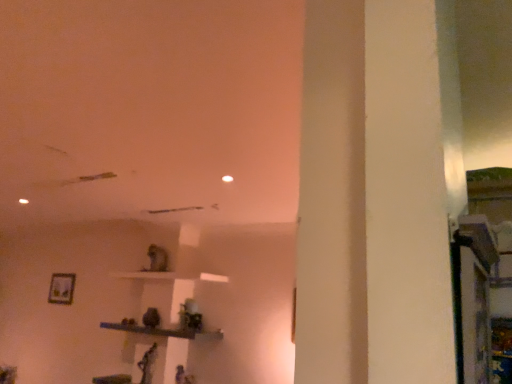
What do you see at coordinates (61, 288) in the screenshot? The height and width of the screenshot is (384, 512). I see `matte silver picture frame at lower left` at bounding box center [61, 288].

Measure the distance between point (70,273) and camera.

Point (70,273) is 5.16 meters from camera.

At what (x,y) coordinates should I click in order to perform the action: click on matte silver picture frame at lower left. Please return your answer as a coordinate pair (x, y). The image size is (512, 384). Looking at the image, I should click on (61, 288).

Image resolution: width=512 pixels, height=384 pixels. I want to click on wooden shelf at center, so click(x=164, y=331).

Describe the element at coordinates (164, 331) in the screenshot. I see `wooden shelf at center` at that location.

The height and width of the screenshot is (384, 512). In order to click on matte silver picture frame at lower left in this screenshot , I will do (61, 288).

Which is more to the right, wooden shelf at center or matte silver picture frame at lower left?

wooden shelf at center.

In the image, is wooden shelf at center positioned in front of or behind matte silver picture frame at lower left?

Visually, wooden shelf at center is located in front of matte silver picture frame at lower left.

Which is in front, point (170, 330) or point (55, 274)?

Positioned in front is point (170, 330).

From the image's perspective, is wooden shelf at center on matte silver picture frame at lower left?

No.

Based on the photo, from a real-world perspective, which object stands above the other?

From a 3D spatial view, matte silver picture frame at lower left is above.

Considering the sizes of objects wooden shelf at center and matte silver picture frame at lower left in the image provided, who is wider, wooden shelf at center or matte silver picture frame at lower left?

wooden shelf at center is wider.

Is wooden shelf at center taller or shorter than matte silver picture frame at lower left?

Clearly, wooden shelf at center is shorter compared to matte silver picture frame at lower left.

Does wooden shelf at center have a smaller size compared to matte silver picture frame at lower left?

Incorrect, wooden shelf at center is not smaller in size than matte silver picture frame at lower left.

Is matte silver picture frame at lower left located within wooden shelf at center?

Actually, matte silver picture frame at lower left is outside wooden shelf at center.

Is wooden shelf at center positioned far away from matte silver picture frame at lower left?

wooden shelf at center is positioned a significant distance from matte silver picture frame at lower left.

Is wooden shelf at center turned away from matte silver picture frame at lower left?

That's not correct — wooden shelf at center is not looking away from matte silver picture frame at lower left.

How many degrees apart are the facing directions of wooden shelf at center and matte silver picture frame at lower left?

There is a 1.8-degree angle between the facing directions of wooden shelf at center and matte silver picture frame at lower left.

Where is `furniture in front of the matte silver picture frame at lower left`? This screenshot has width=512, height=384. furniture in front of the matte silver picture frame at lower left is located at coordinates click(164, 331).

Considering the relative positions of matte silver picture frame at lower left and wooden shelf at center in the image provided, is matte silver picture frame at lower left to the right of wooden shelf at center from the viewer's perspective?

No.

Is matte silver picture frame at lower left further to the viewer compared to wooden shelf at center?

Yes, it is.

Is point (65, 303) positioned behind point (136, 325)?

Yes, point (65, 303) is behind point (136, 325).

From the image's perspective, is matte silver picture frame at lower left under wooden shelf at center?

No, from the image's perspective, matte silver picture frame at lower left is not below wooden shelf at center.

From a real-world perspective, is matte silver picture frame at lower left located higher than wooden shelf at center?

Yes.

Considering the sizes of objects matte silver picture frame at lower left and wooden shelf at center in the image provided, who is thinner, matte silver picture frame at lower left or wooden shelf at center?

With smaller width is matte silver picture frame at lower left.

From their relative heights in the image, would you say matte silver picture frame at lower left is taller or shorter than wooden shelf at center?

matte silver picture frame at lower left is taller than wooden shelf at center.

Considering the sizes of objects matte silver picture frame at lower left and wooden shelf at center in the image provided, who is smaller, matte silver picture frame at lower left or wooden shelf at center?

With smaller size is matte silver picture frame at lower left.

Is matte silver picture frame at lower left located outside wooden shelf at center?

matte silver picture frame at lower left is positioned outside wooden shelf at center.

Is matte silver picture frame at lower left next to wooden shelf at center and touching it?

matte silver picture frame at lower left and wooden shelf at center are clearly separated.

Is matte silver picture frame at lower left oriented towards wooden shelf at center?

No, matte silver picture frame at lower left is not turned towards wooden shelf at center.

Image resolution: width=512 pixels, height=384 pixels. What are the coordinates of `picture frame above the wooden shelf at center (from a real-world perspective)` in the screenshot? It's located at (61, 288).

This screenshot has width=512, height=384. I want to click on furniture below the matte silver picture frame at lower left (from a real-world perspective), so click(164, 331).

I want to click on furniture on the right side of matte silver picture frame at lower left, so click(164, 331).